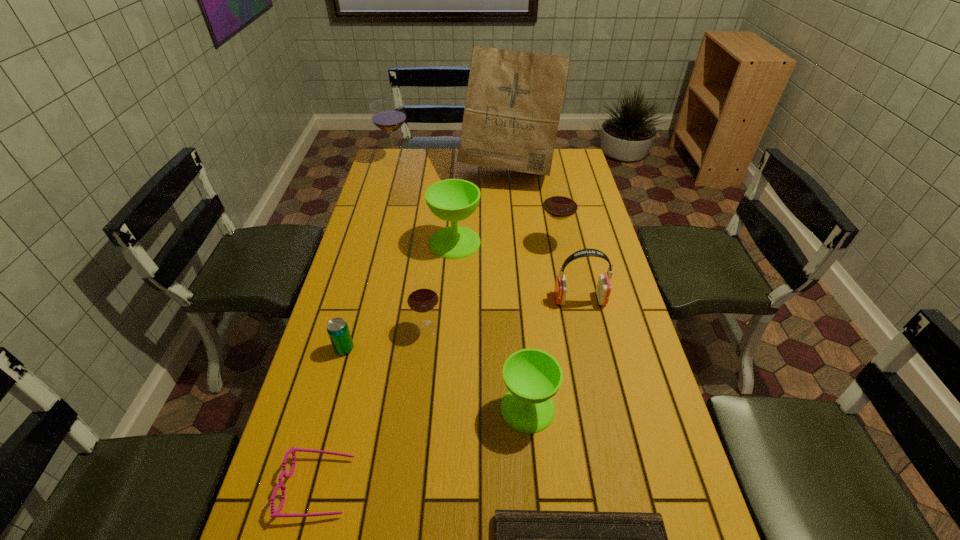
Where is `the tallest object`? The height and width of the screenshot is (540, 960). the tallest object is located at coordinates (514, 99).

Locate an element on the screen. The width and height of the screenshot is (960, 540). brown grocery bag is located at coordinates (514, 99).

This screenshot has width=960, height=540. What are the coordinates of `the tallest wineglass` in the screenshot? It's located at (388, 115).

Locate an element on the screen. the second tallest object is located at coordinates (388, 115).

The height and width of the screenshot is (540, 960). Identify the location of the bigger green wineglass. (453, 200).

Where is `the left green wineglass`? the left green wineglass is located at coordinates (453, 200).

Identify the location of the second biggest red wineglass. (561, 202).

This screenshot has width=960, height=540. Identify the location of the rightmost wineglass. (561, 202).

What are the coordinates of `earphone` in the screenshot? It's located at (603, 289).

Find the location of `pink earphone`. pink earphone is located at coordinates (603, 289).